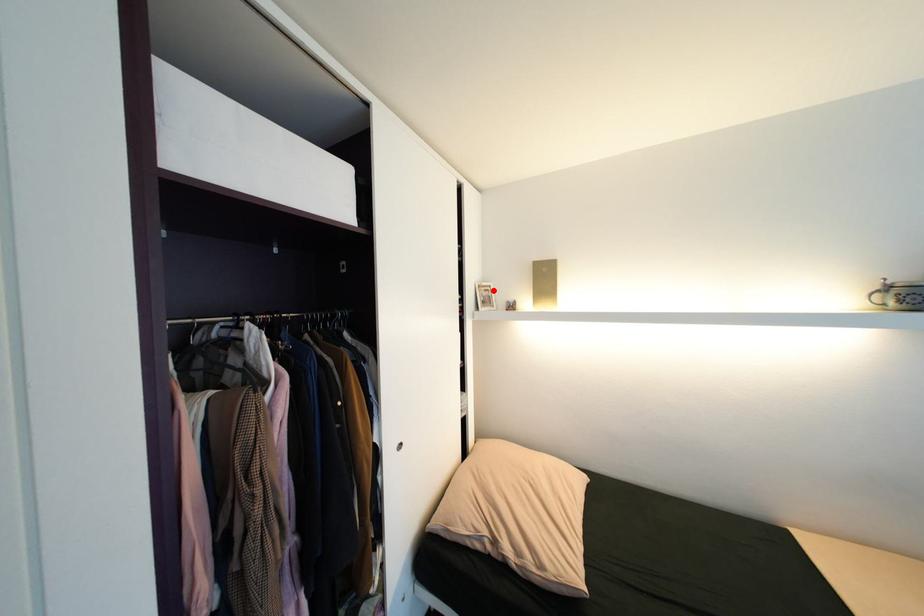
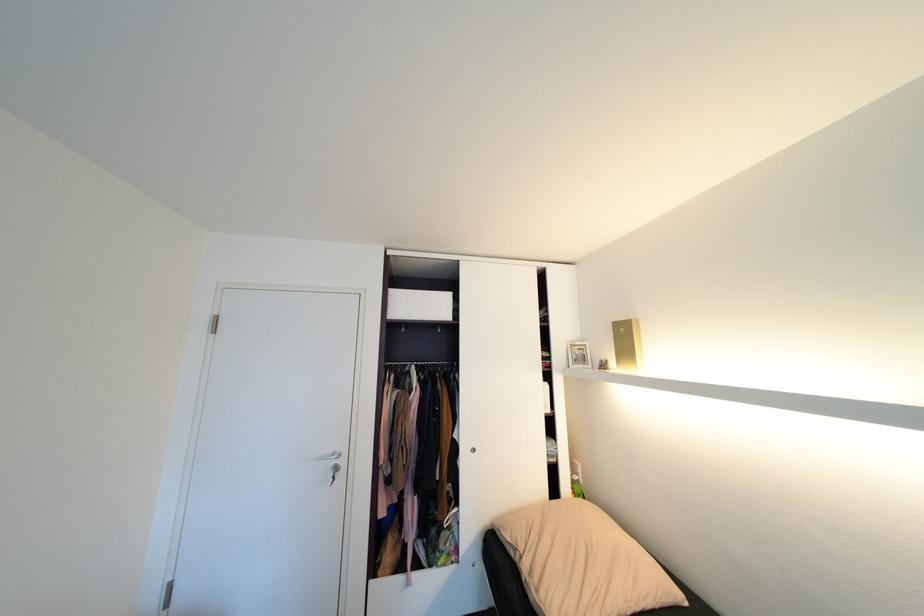
Locate, in the second image, the point that corresponds to the highlighted location in the first image.

(587, 350)